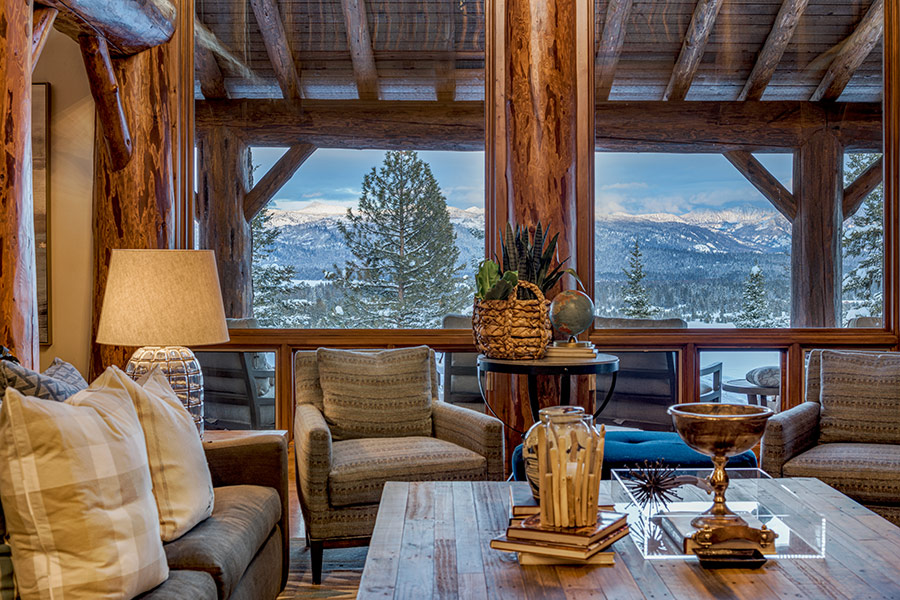
Find the location of a particular element. The width and height of the screenshot is (900, 600). wide vertical brown wood beam is located at coordinates (540, 168).